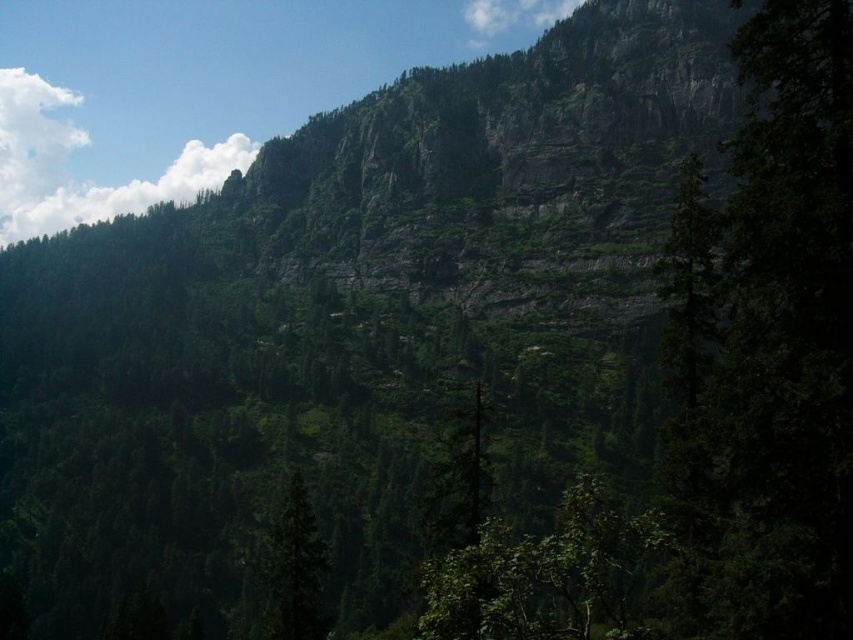
You are a hiker standing at the base of the mountain. You see a point marked at coordinates (547, 576). According to the map, this point is on a green leafy tree at center. Considering the terrain described, would this tree be a good landmark for navigation?

The point at (547, 576) is on a green leafy tree at center. Since the tree is centrally located and surrounded by steep cliffs and rocky outcrops with sparse vegetation higher up, this tree would likely be a prominent landmark visible from various angles, making it a reliable navigation point.

You are a hiker standing at the base of the mountain looking up. You see a green leafy tree at center and a white fluffy cloud at upper center. Which object is higher in elevation?

The white fluffy cloud at upper center is higher in elevation than the green leafy tree at center because the cloud is positioned above the tree in the sky.

You are a hiker who wants to take a photo of the green leafy tree at center from the base of the cliffs. Considering the coordinates provided, which direction should you position yourself relative to the tree to capture it in the frame with the cliffs as the background?

To capture the green leafy tree at center with the cliffs as the background, you should position yourself in front of the tree, facing towards the cliffs. The coordinates indicate the tree is located at the center of the image, so aligning the camera towards the cliffs behind it would frame the tree against the mountain backdrop.